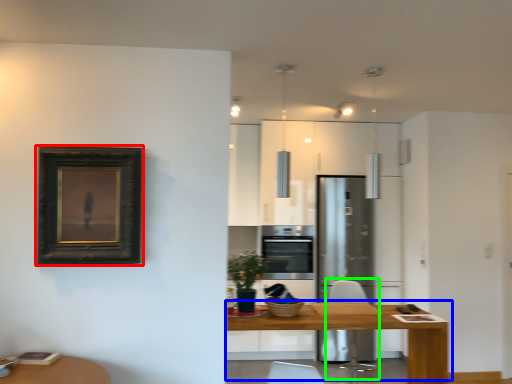
Question: Which is nearer to the picture frame (highlighted by a red box)? table (highlighted by a blue box) or swivel chair (highlighted by a green box).

Choices:
 (A) table
 (B) swivel chair

Answer: (A)